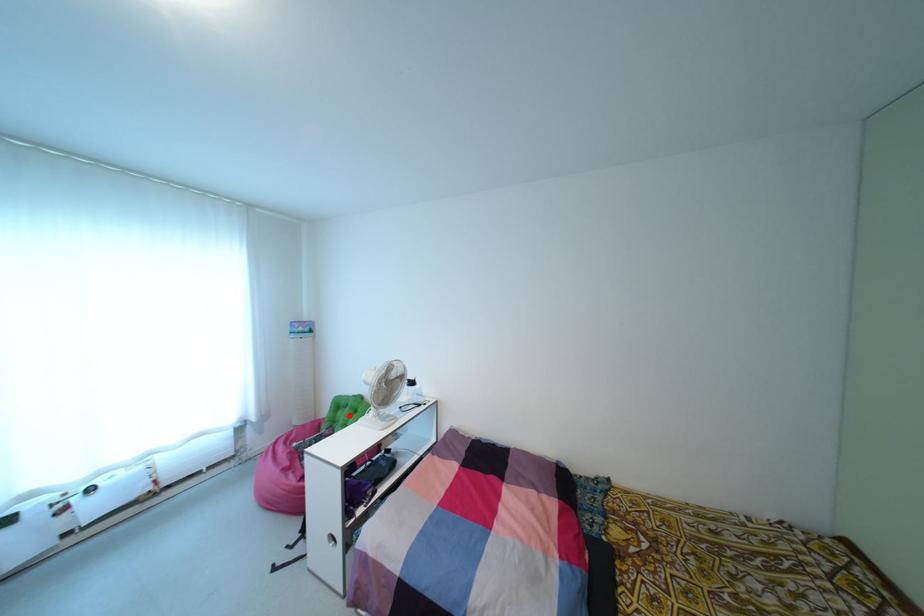
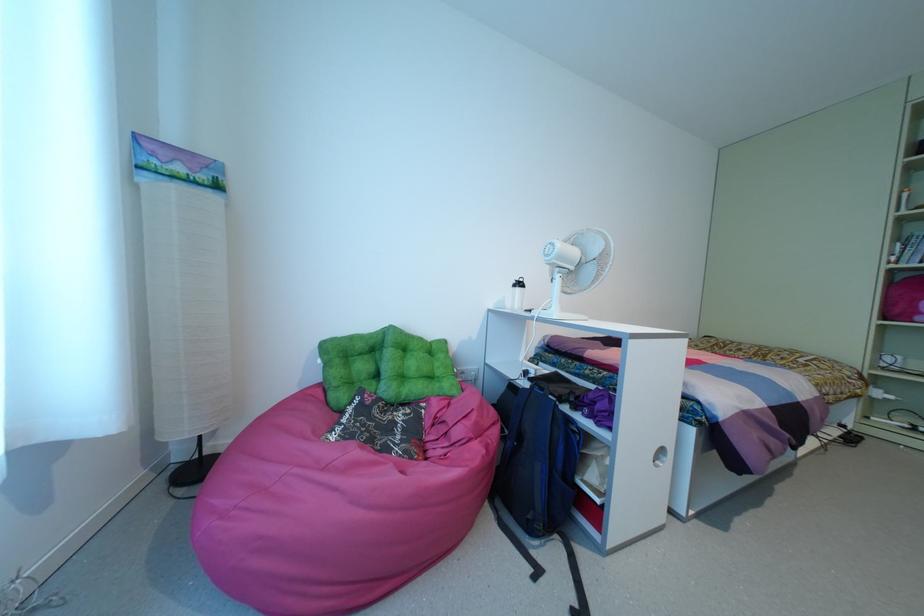
Question: A red point is marked in image1. In image2, is the corresponding 3D point closer to the camera or farther? Reply with the corresponding letter.

Choices:
 (A) The corresponding 3D point is closer.
 (B) The corresponding 3D point is farther.

Answer: (A)